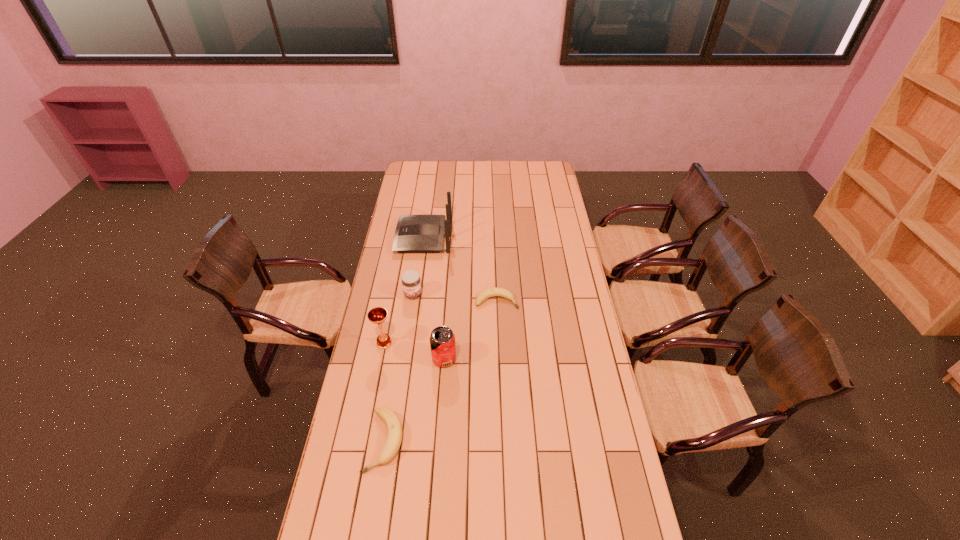
This screenshot has height=540, width=960. Find the location of `vacant space that satisfies the following two spatial constraints: 1. on the front-facing side of the router; 2. on the front label of the jam`. vacant space that satisfies the following two spatial constraints: 1. on the front-facing side of the router; 2. on the front label of the jam is located at coordinates (416, 295).

In order to click on vacant space that satisfies the following two spatial constraints: 1. on the front side of the fourth shortest object; 2. on the left side of the chalice in this screenshot , I will do `click(381, 359)`.